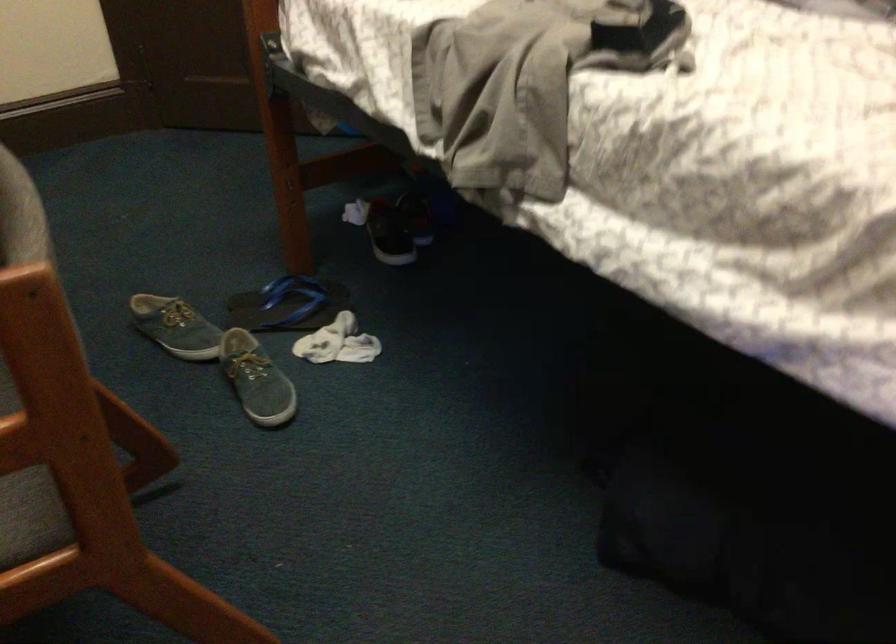
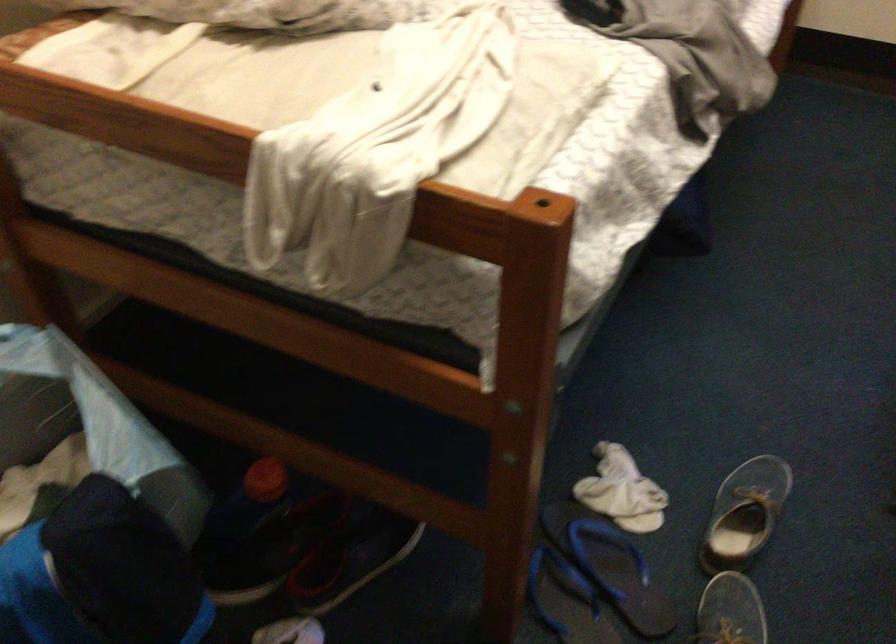
Where in the second image is the point corresponding to [286,301] from the first image?

(566, 600)